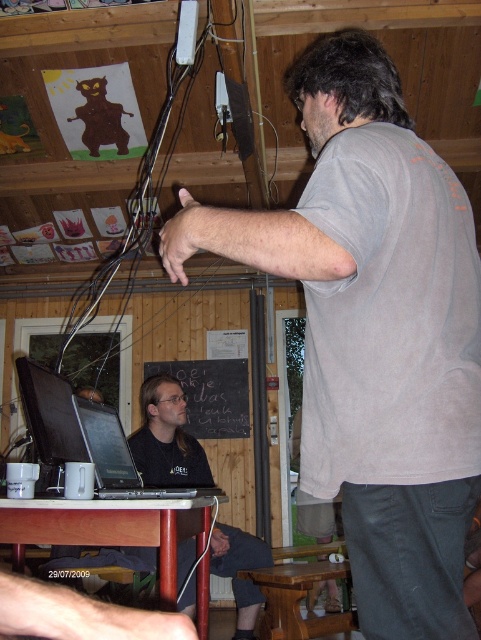
Question: Which object is farther from the camera taking this photo?

Choices:
 (A) black chalkboard at center
 (B) black matte shirt at lower left

Answer: (A)

Question: Which object is closer to the camera taking this photo?

Choices:
 (A) black matte shirt at lower left
 (B) wooden stool at lower center
 (C) black wire at upper center
 (D) black chalkboard at center

Answer: (C)

Question: Is gray cotton shirt at upper right in front of black wire at upper center?

Choices:
 (A) no
 (B) yes

Answer: (B)

Question: Does black wire at upper center appear over wooden stool at lower center?

Choices:
 (A) yes
 (B) no

Answer: (A)

Question: Can you confirm if black wire at upper center is positioned to the left of wooden stool at lower center?

Choices:
 (A) yes
 (B) no

Answer: (A)

Question: Which is farther from the gray cotton shirt at upper right?

Choices:
 (A) black matte shirt at lower left
 (B) silver metallic laptop at center

Answer: (A)